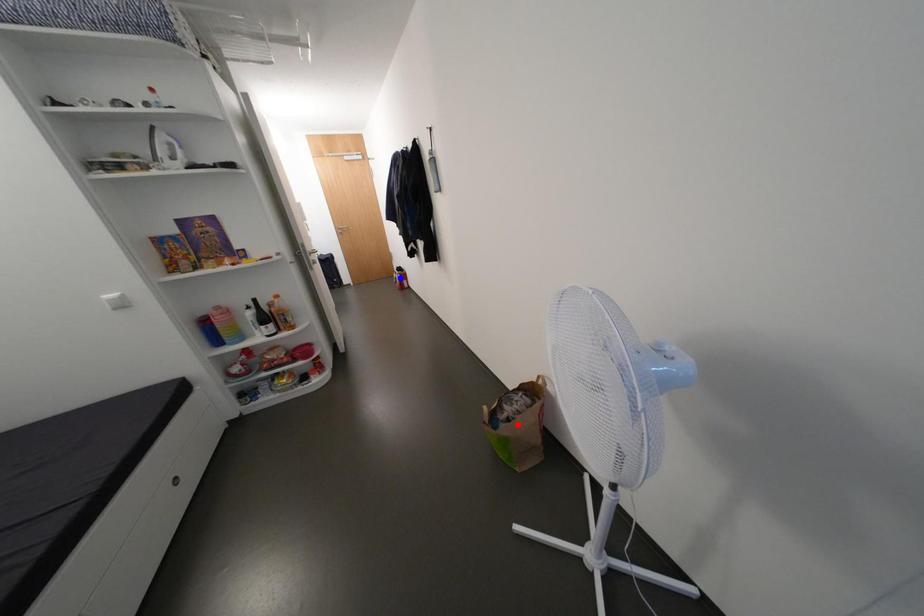
Question: In the image, two points are highlighted. Which point is nearer to the camera? Reply with the corresponding letter.

Choices:
 (A) blue point
 (B) red point

Answer: (B)